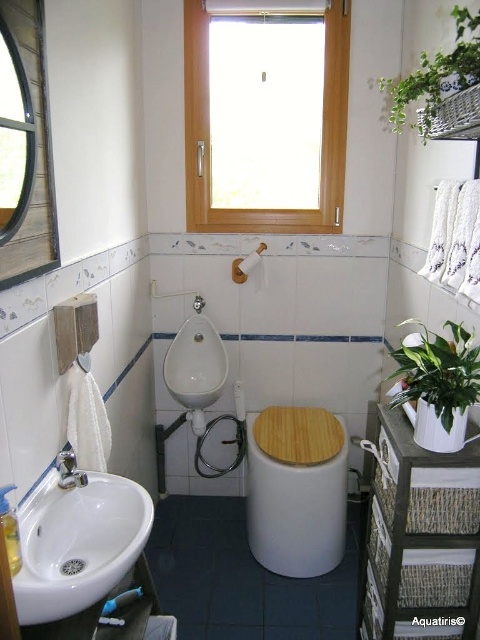
Question: Does white glossy sink at lower left have a smaller size compared to white glossy urinal at center?

Choices:
 (A) no
 (B) yes

Answer: (B)

Question: Is green leafy plant at right closer to the viewer compared to green leafy plant at upper right?

Choices:
 (A) no
 (B) yes

Answer: (A)

Question: Among these points, which one is nearest to the camera?

Choices:
 (A) (68, 477)
 (B) (456, 371)

Answer: (B)

Question: Can you confirm if green leafy plant at right is bigger than brushed metal faucet at lower left?

Choices:
 (A) yes
 (B) no

Answer: (A)

Question: Estimate the real-world distances between objects in this image. Which object is farther from the green leafy plant at right?

Choices:
 (A) green leafy plant at upper right
 (B) white glossy sink at lower left

Answer: (B)

Question: Which object appears farthest from the camera in this image?

Choices:
 (A) green leafy plant at right
 (B) white glossy sink at lower left
 (C) white glossy toilet bowl at lower right
 (D) wooden window at upper center

Answer: (D)